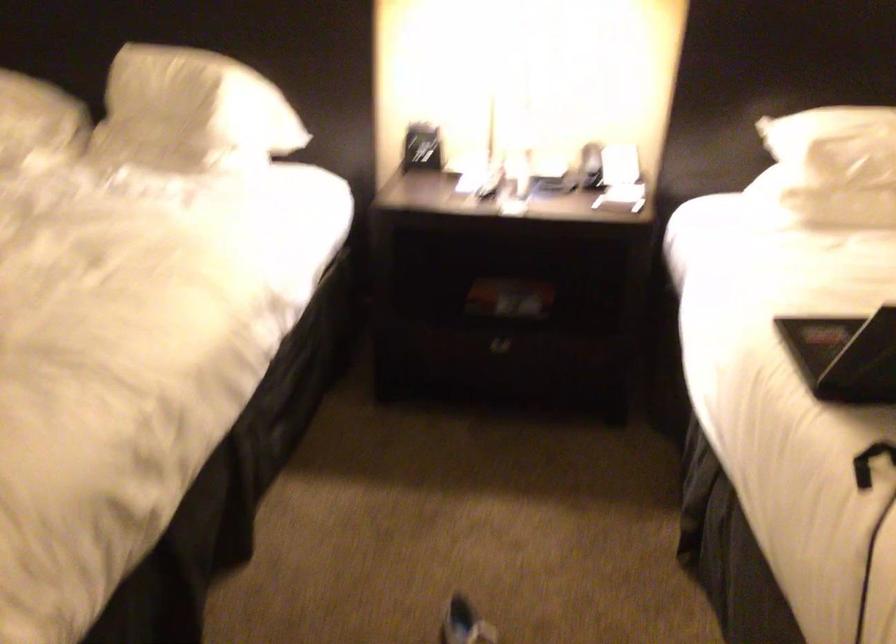
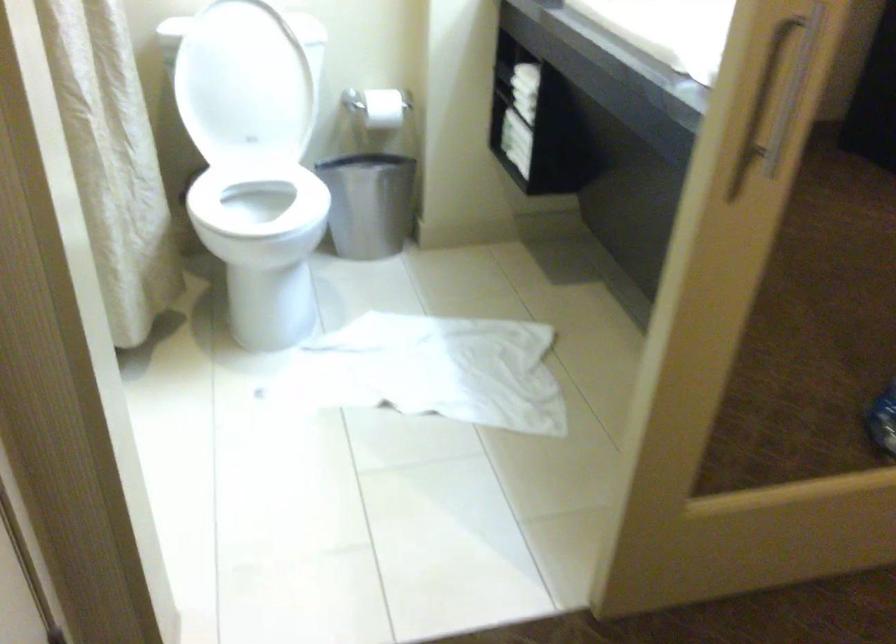
Question: What movement of the cameraman would produce the second image?

Choices:
 (A) Left
 (B) Right
 (C) Forward
 (D) Backward

Answer: (A)